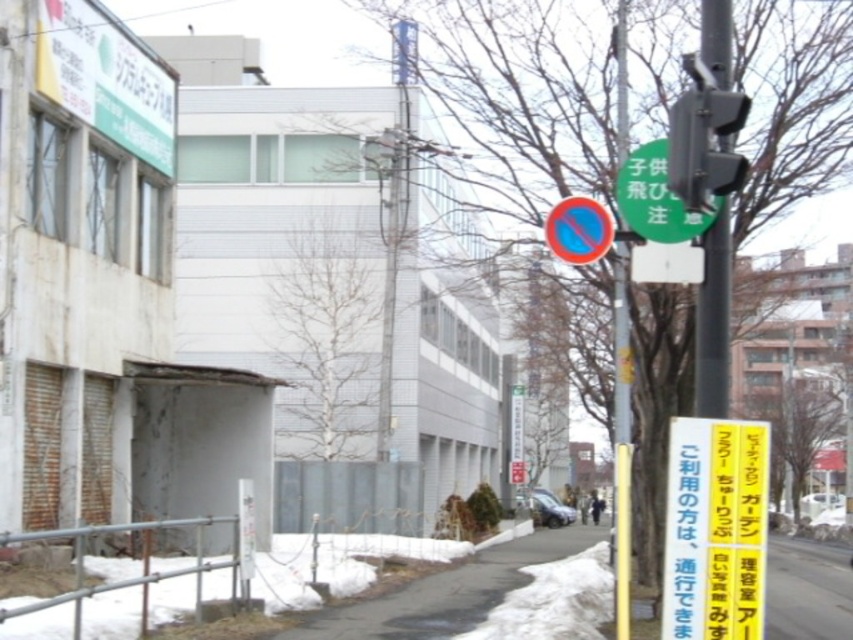
Question: Can you confirm if black asphalt pavement at lower center is positioned to the right of green matte sign at upper center?

Choices:
 (A) no
 (B) yes

Answer: (B)

Question: Which point is farther from the camera taking this photo?

Choices:
 (A) (688, 435)
 (B) (703, 292)
 (C) (628, 202)
 (D) (553, 545)

Answer: (D)

Question: Is the position of black asphalt pavement at lower center more distant than that of metallic pole at right?

Choices:
 (A) no
 (B) yes

Answer: (B)

Question: Which point appears closest to the camera in this image?

Choices:
 (A) (555, 520)
 (B) (654, 148)

Answer: (B)

Question: Can you confirm if yellow paper sign at lower right is positioned to the right of metallic pole at right?

Choices:
 (A) yes
 (B) no

Answer: (B)

Question: Among these points, which one is nearest to the camera?

Choices:
 (A) (515, 499)
 (B) (747, 496)

Answer: (B)